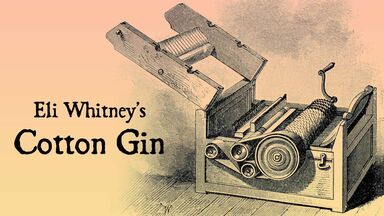
Where is `wooden floor`? wooden floor is located at coordinates (175, 196), (213, 205), (250, 208), (286, 212), (372, 200).